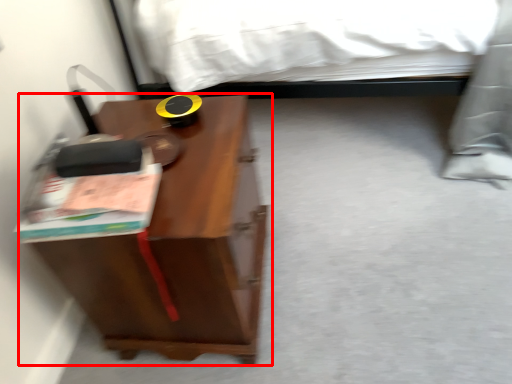
Question: From the image's perspective, where is nightstand (annotated by the red box) located relative to paperback book?

Choices:
 (A) below
 (B) above

Answer: (A)